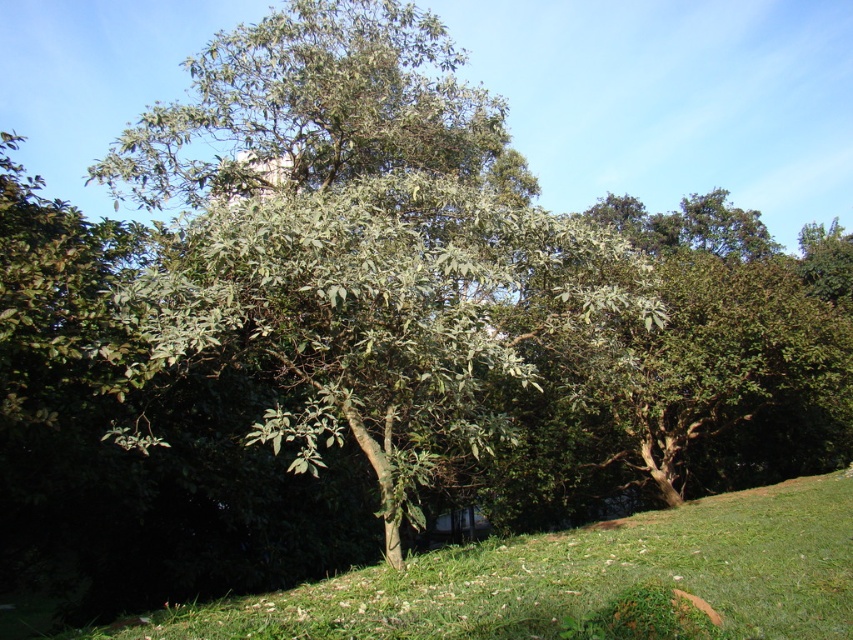
You are a gardener assessing the landscape. You notice the green leafy tree at center and the green grassy at lower center. Which object is taller?

The green leafy tree at center is taller than the green grassy at lower center.

You are standing at point (364, 243) in the image. What object is located exactly at this point?

The green leafy tree at center is located exactly at point (364, 243).